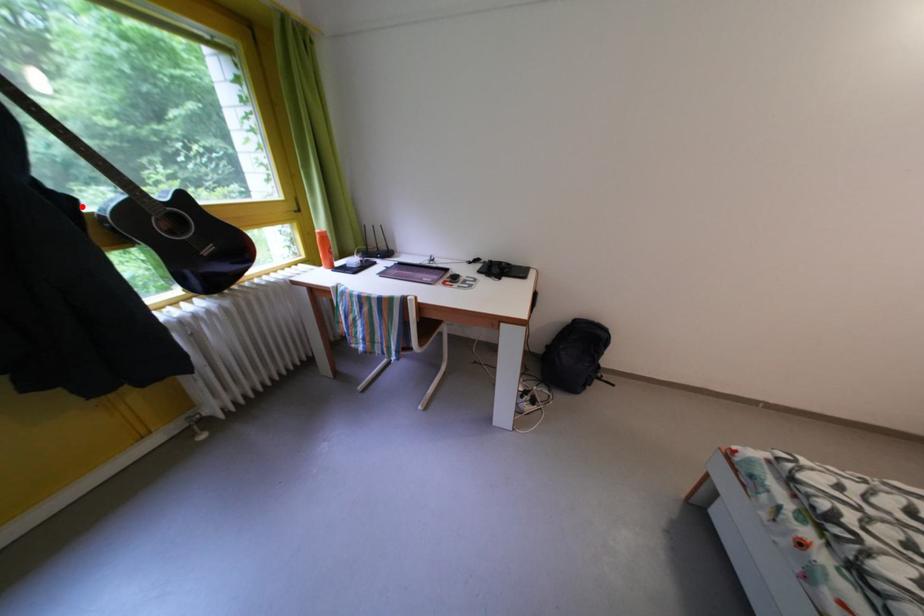
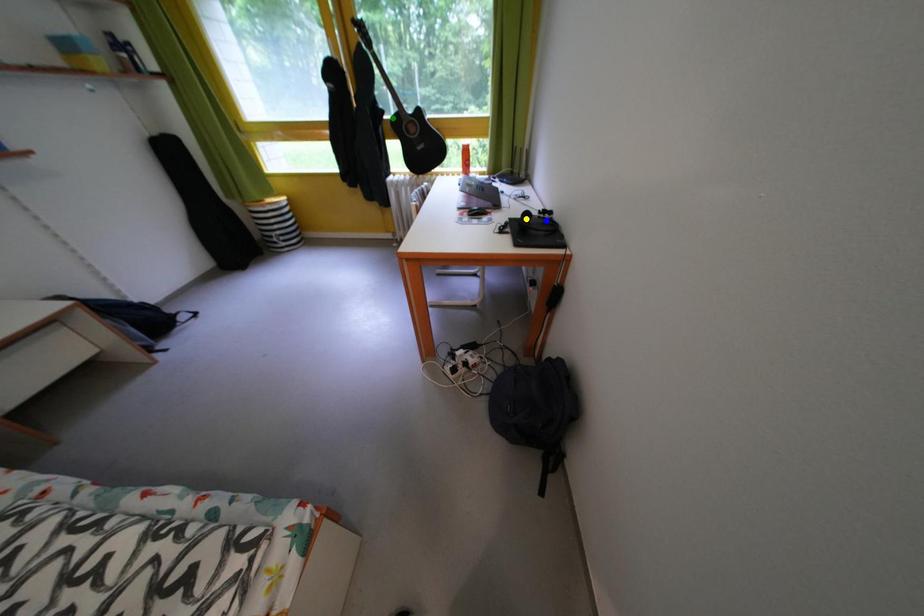
Question: I am providing you with two images of the same scene from different viewpoints. A red point is marked on the first image. You are given multiple points on the second image. Can you choose the point in image 2 that corresponds to the point in image 1?

Choices:
 (A) blue point
 (B) green point
 (C) yellow point

Answer: (B)